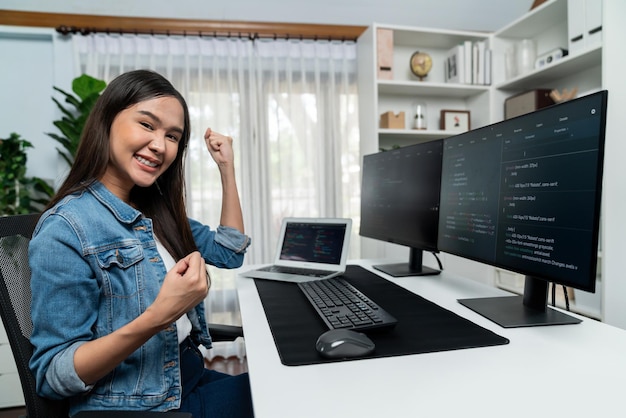
The image size is (626, 418). I want to click on desk, so click(x=463, y=382).